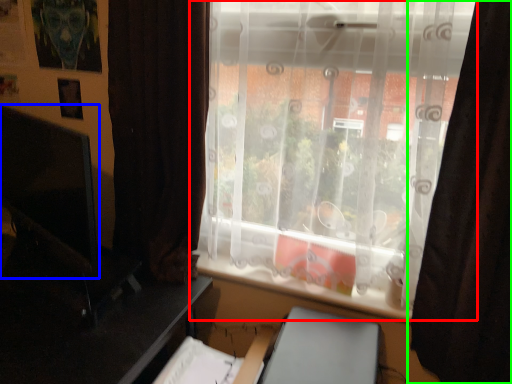
Question: Estimate the real-world distances between objects in this image. Which object is closer to window (highlighted by a red box), computer monitor (highlighted by a blue box) or curtain (highlighted by a green box)?

Choices:
 (A) computer monitor
 (B) curtain

Answer: (B)